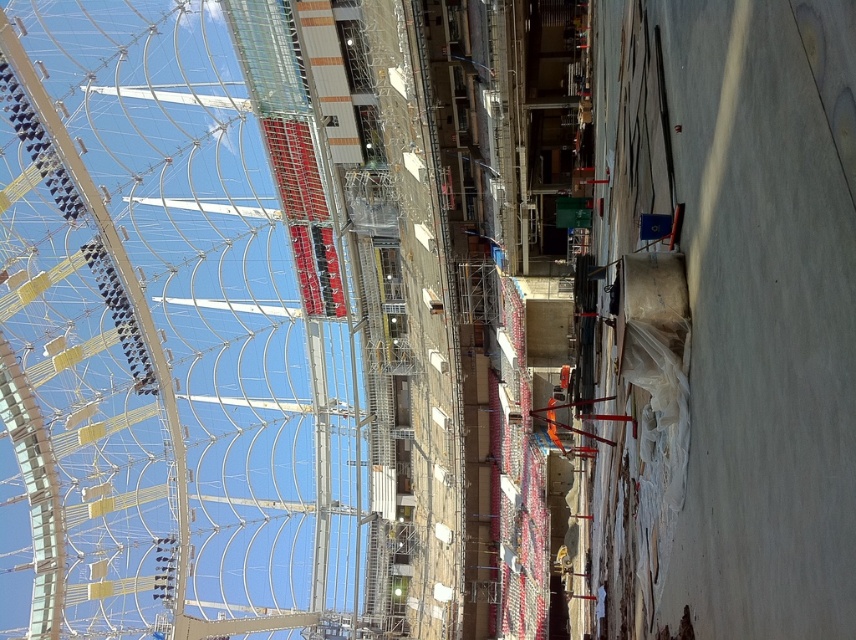
Based on the photo, between metallic scaffolding at upper center and concrete slab at right, which one appears on the left side from the viewer's perspective?

From the viewer's perspective, metallic scaffolding at upper center appears more on the left side.

Is point (80, 580) more distant than point (771, 332)?

Yes, it is.

Locate an element on the screen. This screenshot has height=640, width=856. metallic scaffolding at upper center is located at coordinates (169, 330).